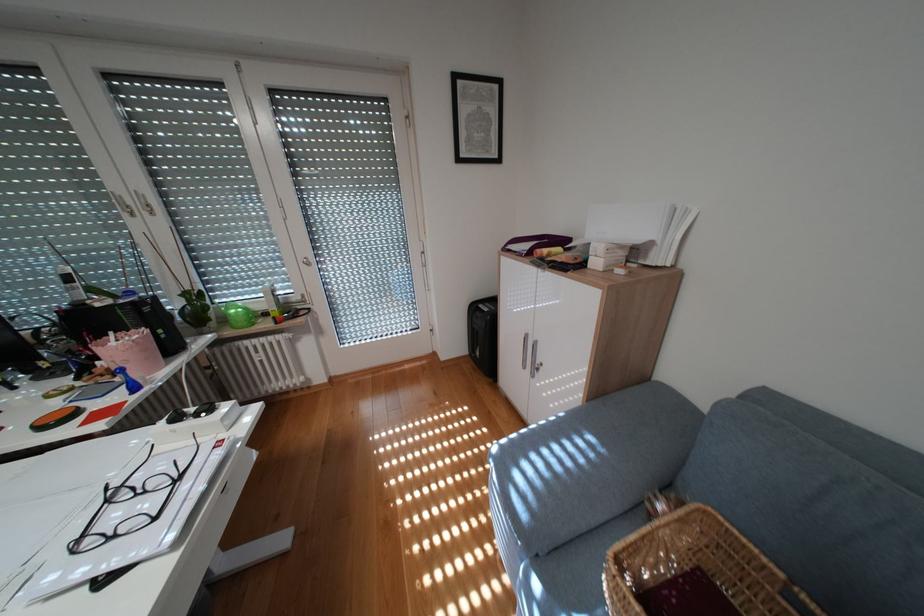
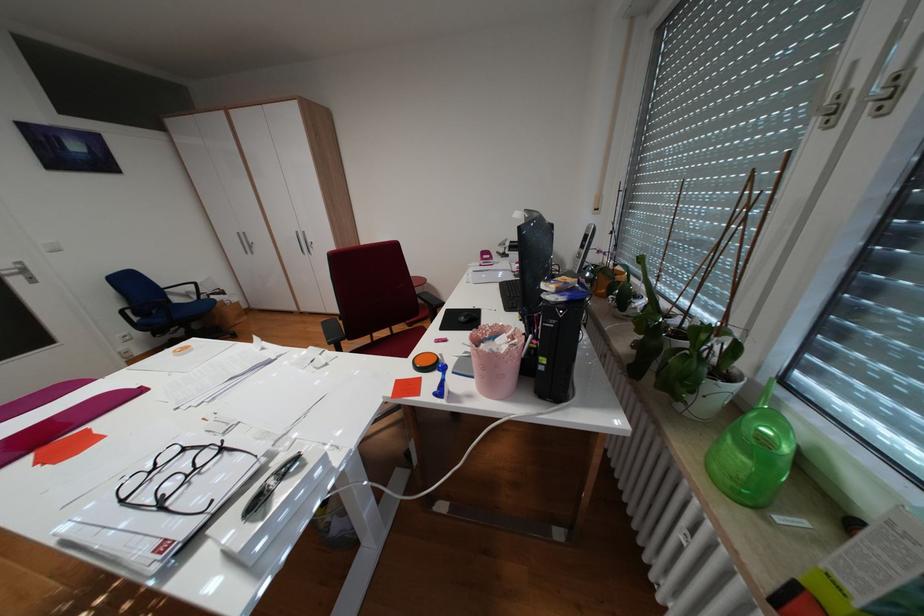
In the second image, find the point that corresponds to [189,479] in the first image.

(173, 505)